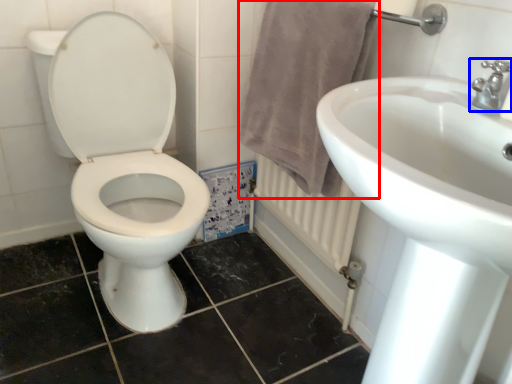
Question: Which object appears closest to the camera in this image, bath towel (highlighted by a red box) or tap (highlighted by a blue box)?

Choices:
 (A) bath towel
 (B) tap

Answer: (B)